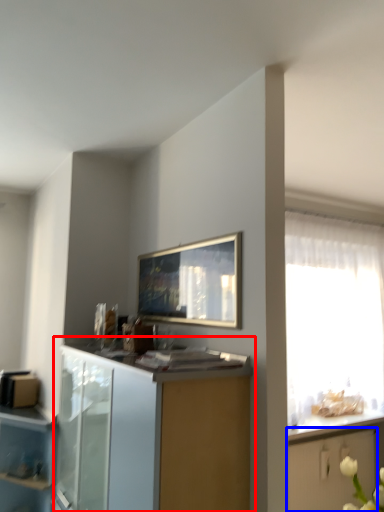
Question: Which object is further to the camera taking this photo, cabinetry (highlighted by a red box) or cabinetry (highlighted by a blue box)?

Choices:
 (A) cabinetry
 (B) cabinetry

Answer: (B)